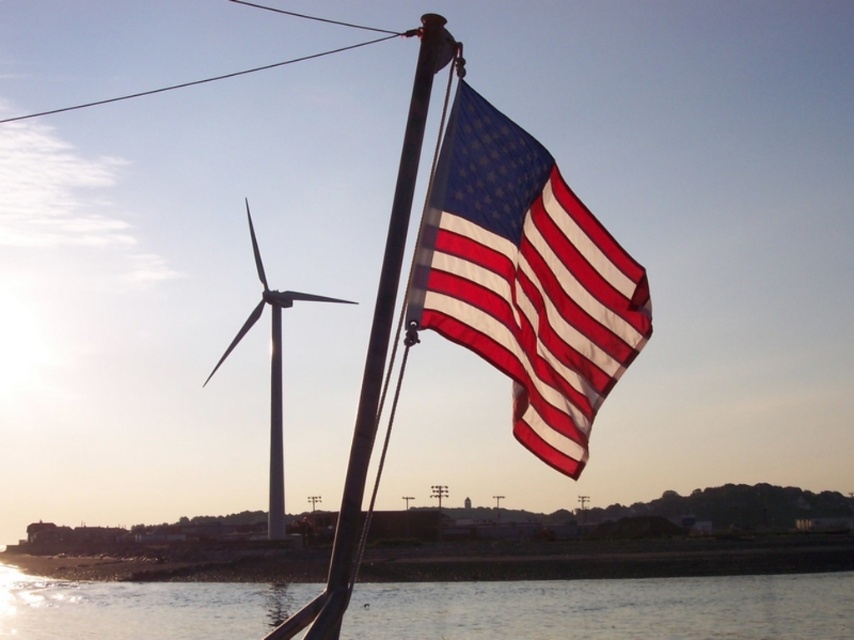
You are a photographer trying to capture the metallic flag pole at center and the transparent water at lower center in a single shot. Based on their relative sizes in the image, which object appears larger?

The transparent water at lower center appears larger because it is much taller than the metallic flag pole at center in the image.

You are standing at the point marked by the coordinates point (607, 609) in the image. Based on the scene described, what would you most likely see around you?

You would most likely see transparent water at lower center around you, as the coordinates point (607, 609) indicates transparent water at lower center.